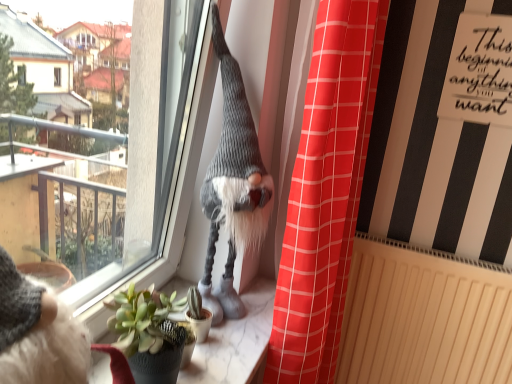
In order to click on free space in front of knitted gray gnome at center in this screenshot , I will do `click(226, 354)`.